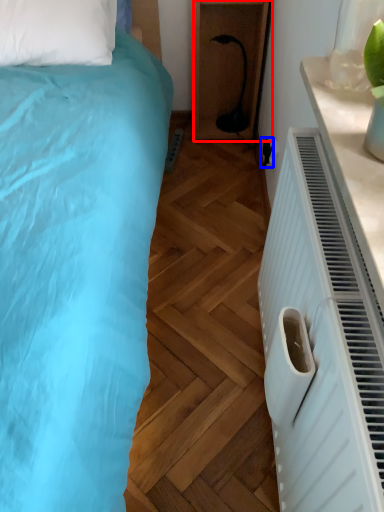
Question: Which object is further to the camera taking this photo, furniture (highlighted by a red box) or electric outlet (highlighted by a blue box)?

Choices:
 (A) furniture
 (B) electric outlet

Answer: (A)